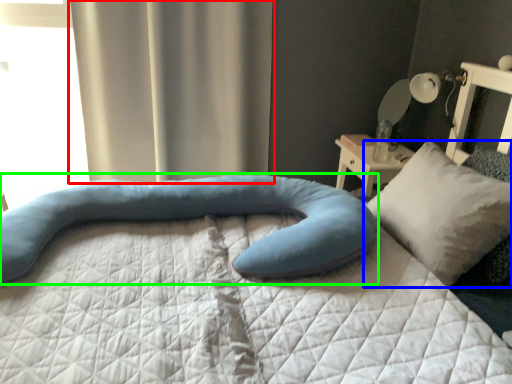
Question: Considering the real-world distances, which object is closest to curtain (highlighted by a red box)? pillow (highlighted by a blue box) or pillow (highlighted by a green box).

Choices:
 (A) pillow
 (B) pillow

Answer: (B)